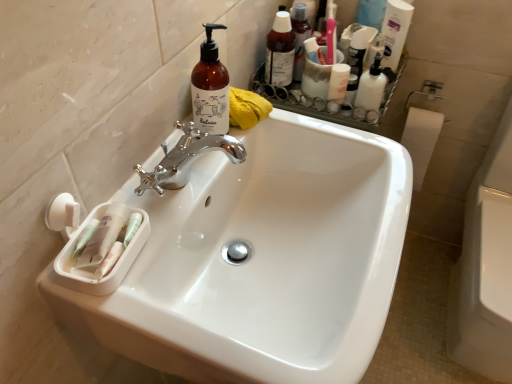
Measure the distance between point (279, 59) and camera.

Point (279, 59) is 1.09 meters away from camera.

Looking at this image, how much space does white glossy lotion at upper right, which is counted as the first toiletry, starting from the right, occupy vertically?

white glossy lotion at upper right, which is counted as the first toiletry, starting from the right, is 5.94 inches tall.

In order to click on white glossy lotion at upper right, which is counted as the first toiletry, starting from the right in this screenshot , I will do `click(370, 92)`.

Locate an element on the screen. This screenshot has width=512, height=384. brown glass bottle at upper center, the first cleaning product in the front-to-back sequence is located at coordinates (210, 88).

Is translucent plastic pump bottle at upper right, which is counted as the 1th cleaning product, starting from the right, far from white glossy lotion at upper right, marked as the second toiletry in a left-to-right arrangement?

No, translucent plastic pump bottle at upper right, which is counted as the 1th cleaning product, starting from the right, is in close proximity to white glossy lotion at upper right, marked as the second toiletry in a left-to-right arrangement.

You are a GUI agent. You are given a task and a screenshot of the screen. Output one action in this format:
    pyautogui.click(x=<x>, y=<y>)
    Task: Click on the 2nd toiletry directly beneath the translucent plastic pump bottle at upper right, placed as the second cleaning product when sorted from front to back (from a real-world perspective)
    
    Given the screenshot: What is the action you would take?
    pyautogui.click(x=370, y=92)

From the image's perspective, is translucent plastic pump bottle at upper right, placed as the 1th cleaning product when sorted from top to bottom, over white glossy lotion at upper right, which is counted as the first toiletry, starting from the right?

Correct, translucent plastic pump bottle at upper right, placed as the 1th cleaning product when sorted from top to bottom, appears higher than white glossy lotion at upper right, which is counted as the first toiletry, starting from the right, in the image.

Considering the sizes of objects translucent plastic pump bottle at upper right, placed as the 1th cleaning product when sorted from top to bottom, and white glossy lotion at upper right, which is counted as the first toiletry, starting from the right, in the image provided, who is shorter, translucent plastic pump bottle at upper right, placed as the 1th cleaning product when sorted from top to bottom, or white glossy lotion at upper right, which is counted as the first toiletry, starting from the right,?

white glossy lotion at upper right, which is counted as the first toiletry, starting from the right.

Are translucent plastic bottles at upper right, which ranks as the 2th toiletry in right-to-left order, and white glossy mouthwash at upper right far apart?

That's not correct — translucent plastic bottles at upper right, which ranks as the 2th toiletry in right-to-left order, is a little close to white glossy mouthwash at upper right.

How different are the orientations of translucent plastic bottles at upper right, which ranks as the 2th toiletry in right-to-left order, and white glossy mouthwash at upper right in degrees?

93.1 degrees.

Consider the image. From a real-world perspective, is translucent plastic bottles at upper right, marked as the 1th toiletry in a left-to-right arrangement, positioned above or below white glossy mouthwash at upper right?

translucent plastic bottles at upper right, marked as the 1th toiletry in a left-to-right arrangement, is situated higher than white glossy mouthwash at upper right in the real world.

Is translucent plastic bottles at upper right, marked as the 1th toiletry in a left-to-right arrangement, thinner than white glossy mouthwash at upper right?

No.

Is white glossy toilet at right completely or partially outside of translucent plastic bottles at upper right, marked as the 1th toiletry in a left-to-right arrangement?

Yes.

Considering the positions of points (480, 328) and (288, 20), is point (480, 328) farther from camera compared to point (288, 20)?

No, it is not.

In terms of width, does white glossy toilet at right look wider or thinner when compared to translucent plastic bottles at upper right, marked as the 1th toiletry in a left-to-right arrangement?

Clearly, white glossy toilet at right has more width compared to translucent plastic bottles at upper right, marked as the 1th toiletry in a left-to-right arrangement.

From the image's perspective, does white glossy toilet at right appear higher than translucent plastic bottles at upper right, marked as the 1th toiletry in a left-to-right arrangement?

Actually, white glossy toilet at right appears below translucent plastic bottles at upper right, marked as the 1th toiletry in a left-to-right arrangement, in the image.

From the image's perspective, is white glossy sink at center positioned above or below translucent plastic bottles at upper right, marked as the 1th toiletry in a left-to-right arrangement?

From the image's perspective, white glossy sink at center appears below translucent plastic bottles at upper right, marked as the 1th toiletry in a left-to-right arrangement.

Between white glossy sink at center and translucent plastic bottles at upper right, marked as the 1th toiletry in a left-to-right arrangement, which one has more height?

With more height is white glossy sink at center.

Does white glossy sink at center turn towards translucent plastic bottles at upper right, which ranks as the 2th toiletry in right-to-left order?

No, white glossy sink at center is not aimed at translucent plastic bottles at upper right, which ranks as the 2th toiletry in right-to-left order.

Can you confirm if translucent plastic pump bottle at upper right, placed as the 1th cleaning product when sorted from top to bottom, is positioned to the left of white glossy mouthwash at upper right?

In fact, translucent plastic pump bottle at upper right, placed as the 1th cleaning product when sorted from top to bottom, is to the right of white glossy mouthwash at upper right.

In order to click on mouthwash that appears on the left of translucent plastic pump bottle at upper right, acting as the 1th cleaning product starting from the back in this screenshot , I will do `click(338, 82)`.

Is translucent plastic pump bottle at upper right, positioned as the 2th cleaning product in left-to-right order, beside white glossy mouthwash at upper right?

No.

From the image's perspective, between translucent plastic pump bottle at upper right, which appears as the second cleaning product when ordered from the bottom, and brown glass bottle at upper center, the first cleaning product in the front-to-back sequence, who is located below?

brown glass bottle at upper center, the first cleaning product in the front-to-back sequence.

The height and width of the screenshot is (384, 512). What are the coordinates of `cleaning product below the brown glass bottle at upper center, marked as the 1th cleaning product in a bottom-to-top arrangement (from a real-world perspective)` in the screenshot? It's located at (395, 31).

Does translucent plastic pump bottle at upper right, placed as the second cleaning product when sorted from front to back, have a lesser height compared to brown glass bottle at upper center, the first cleaning product in the left-to-right sequence?

Yes.

From a real-world perspective, which object rests below the other?

translucent plastic pump bottle at upper right, acting as the 1th cleaning product starting from the back, is physically lower.

From the image's perspective, which is above, translucent plastic pump bottle at upper right, acting as the 1th cleaning product starting from the back, or white glossy sink at center?

translucent plastic pump bottle at upper right, acting as the 1th cleaning product starting from the back, appears higher in the image.

Is translucent plastic pump bottle at upper right, placed as the 1th cleaning product when sorted from top to bottom, positioned beyond the bounds of white glossy sink at center?

Yes, translucent plastic pump bottle at upper right, placed as the 1th cleaning product when sorted from top to bottom, is located beyond the bounds of white glossy sink at center.

From a real-world perspective, is translucent plastic pump bottle at upper right, placed as the 1th cleaning product when sorted from top to bottom, physically above white glossy sink at center?

Yes, from a real-world perspective, translucent plastic pump bottle at upper right, placed as the 1th cleaning product when sorted from top to bottom, is over white glossy sink at center

Between point (393, 14) and point (269, 277), which one is positioned behind?

The point (393, 14) is more distant.

At what (x,y) coordinates should I click in order to perform the action: click on cleaning product on the right of white glossy lotion at upper right, marked as the second toiletry in a left-to-right arrangement. Please return your answer as a coordinate pair (x, y). This screenshot has width=512, height=384. Looking at the image, I should click on (395, 31).

Locate an element on the screen. Image resolution: width=512 pixels, height=384 pixels. mouthwash below the translucent plastic bottles at upper right, which ranks as the 2th toiletry in right-to-left order (from the image's perspective) is located at coordinates (338, 82).

In the scene shown: Looking at the image, which one is located further to white glossy lotion at upper right, which is counted as the first toiletry, starting from the right, white glossy toilet at right or translucent plastic pump bottle at upper right, which appears as the second cleaning product when ordered from the bottom?

white glossy toilet at right lies further to white glossy lotion at upper right, which is counted as the first toiletry, starting from the right, than the other object.

Considering their positions, is white glossy toilet at right positioned further to translucent plastic pump bottle at upper right, positioned as the 2th cleaning product in left-to-right order, than white glossy sink at center?

Among the two, white glossy sink at center is located further to translucent plastic pump bottle at upper right, positioned as the 2th cleaning product in left-to-right order.

Estimate the real-world distances between objects in this image. Which object is further from translucent plastic pump bottle at upper right, which appears as the second cleaning product when ordered from the bottom, white glossy toilet at right or translucent plastic bottles at upper right, which ranks as the 2th toiletry in right-to-left order?

Result: white glossy toilet at right.

Based on their spatial positions, is translucent plastic bottles at upper right, which ranks as the 2th toiletry in right-to-left order, or white glossy lotion at upper right, which is counted as the first toiletry, starting from the right, further from brown glass bottle at upper center, which appears as the second cleaning product when viewed from the right?

Among the two, white glossy lotion at upper right, which is counted as the first toiletry, starting from the right, is located further to brown glass bottle at upper center, which appears as the second cleaning product when viewed from the right.

Based on their spatial positions, is white glossy lotion at upper right, which is counted as the first toiletry, starting from the right, or white glossy toilet at right further from translucent plastic bottles at upper right, marked as the 1th toiletry in a left-to-right arrangement?

white glossy toilet at right is positioned further to the anchor translucent plastic bottles at upper right, marked as the 1th toiletry in a left-to-right arrangement.

Looking at this image, looking at the image, which one is located further to translucent plastic pump bottle at upper right, acting as the 1th cleaning product starting from the back, white glossy mouthwash at upper right or white glossy sink at center?

white glossy sink at center is positioned further to the anchor translucent plastic pump bottle at upper right, acting as the 1th cleaning product starting from the back.

Which object lies further to the anchor point brown glass bottle at upper center, the first cleaning product in the front-to-back sequence, white glossy mouthwash at upper right or white glossy sink at center?

Among the two, white glossy mouthwash at upper right is located further to brown glass bottle at upper center, the first cleaning product in the front-to-back sequence.

Based on their spatial positions, is white glossy lotion at upper right, which is counted as the first toiletry, starting from the right, or translucent plastic bottles at upper right, marked as the 1th toiletry in a left-to-right arrangement, closer to white glossy mouthwash at upper right?

The object closer to white glossy mouthwash at upper right is white glossy lotion at upper right, which is counted as the first toiletry, starting from the right.

Locate an element on the screen. The width and height of the screenshot is (512, 384). toiletry situated between brown glass bottle at upper center, marked as the 1th cleaning product in a bottom-to-top arrangement, and white glossy lotion at upper right, which is counted as the first toiletry, starting from the right, from left to right is located at coordinates (280, 51).

Where is `toiletry located between white glossy mouthwash at upper right and white glossy toilet at right in the left-right direction`? The image size is (512, 384). toiletry located between white glossy mouthwash at upper right and white glossy toilet at right in the left-right direction is located at coordinates (370, 92).

You are a GUI agent. You are given a task and a screenshot of the screen. Output one action in this format:
    pyautogui.click(x=<x>, y=<y>)
    Task: Click on the cleaning product between brown glass bottle at upper center, the first cleaning product in the left-to-right sequence, and white glossy toilet at right
    
    Given the screenshot: What is the action you would take?
    pyautogui.click(x=395, y=31)

This screenshot has height=384, width=512. In order to click on mouthwash between brown glass bottle at upper center, arranged as the second cleaning product when viewed from the back, and translucent plastic pump bottle at upper right, acting as the 1th cleaning product starting from the back, from left to right in this screenshot , I will do `click(338, 82)`.